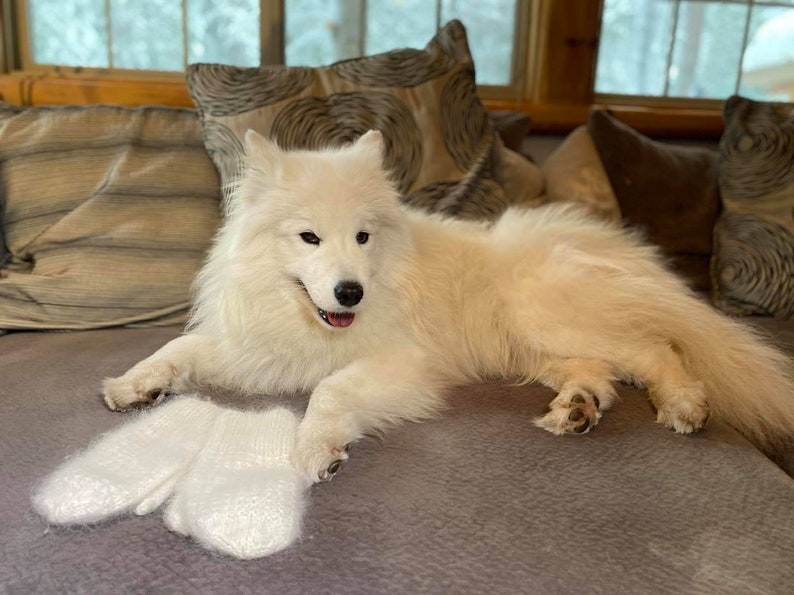
This screenshot has width=794, height=595. I want to click on pillows, so [760, 184], [657, 181], [588, 187], [433, 96], [56, 217].